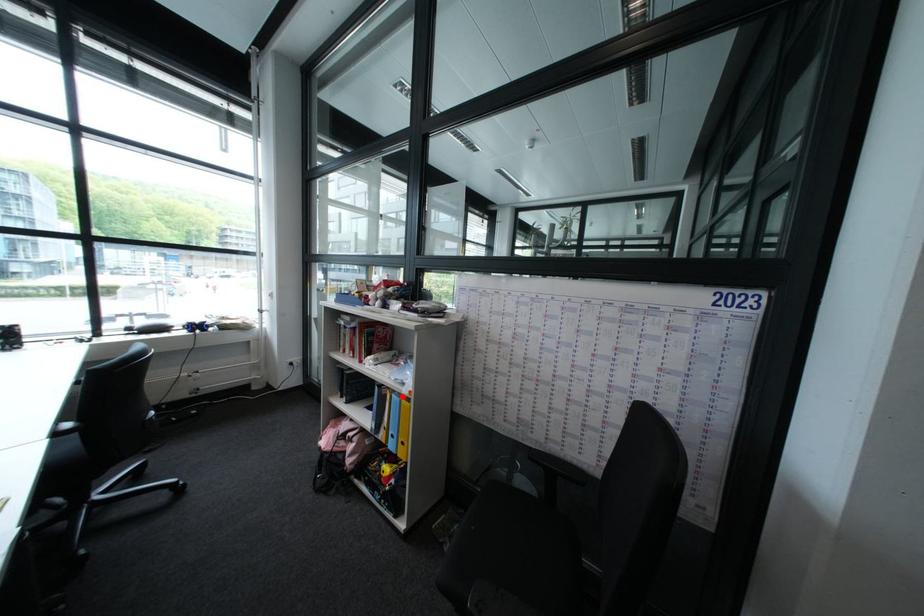
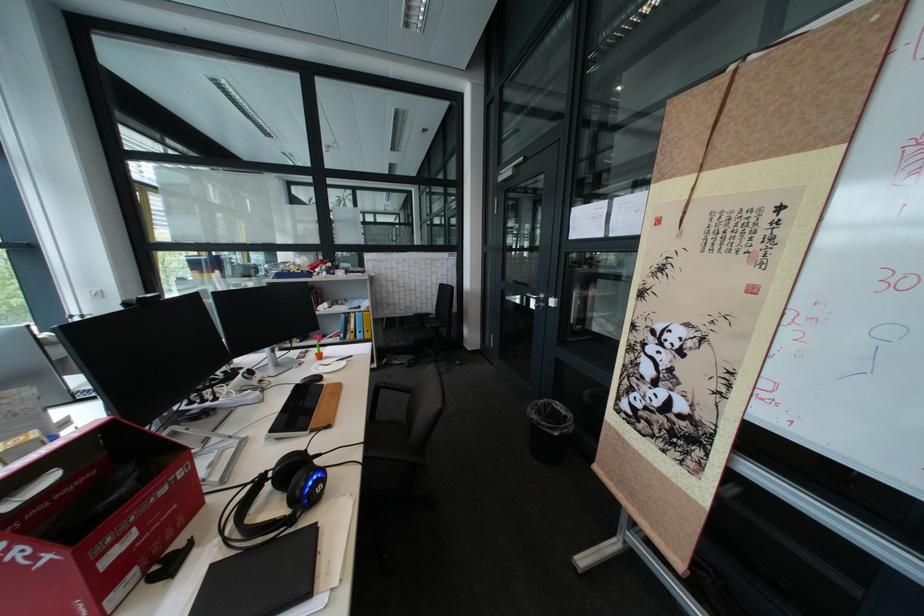
Question: I am providing you with two images of the same scene from different viewpoints. Image1 has a red point marked. In image2, the corresponding 3D location appears at what relative position? Reply with the corresponding letter.

Choices:
 (A) Closer
 (B) Farther

Answer: (A)